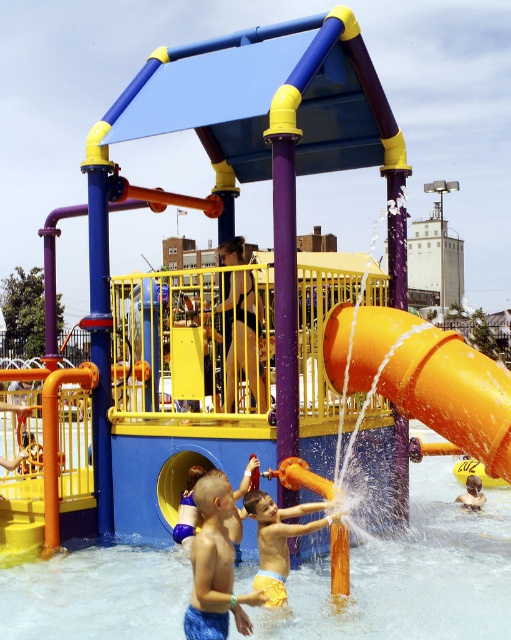
Question: Does orange matte slide at center come in front of smooth yellow rubber duck at lower center?

Choices:
 (A) yes
 (B) no

Answer: (A)

Question: Which of the following is the closest to the observer?

Choices:
 (A) (476, 506)
 (B) (114, 566)

Answer: (B)

Question: Which of the following is the closest to the observer?

Choices:
 (A) (463, 348)
 (B) (200, 497)
 (C) (466, 492)

Answer: (B)

Question: Observing the image, what is the correct spatial positioning of orange matte slide at center in reference to smooth yellow rubber duck at lower center?

Choices:
 (A) below
 (B) above

Answer: (B)

Question: Is orange matte slide at center wider than smooth blue shorts at lower center?

Choices:
 (A) no
 (B) yes

Answer: (A)

Question: Considering the real-world distances, which object is farthest from the orange matte slide at center?

Choices:
 (A) orange matte water at center
 (B) smooth black shorts at center

Answer: (A)